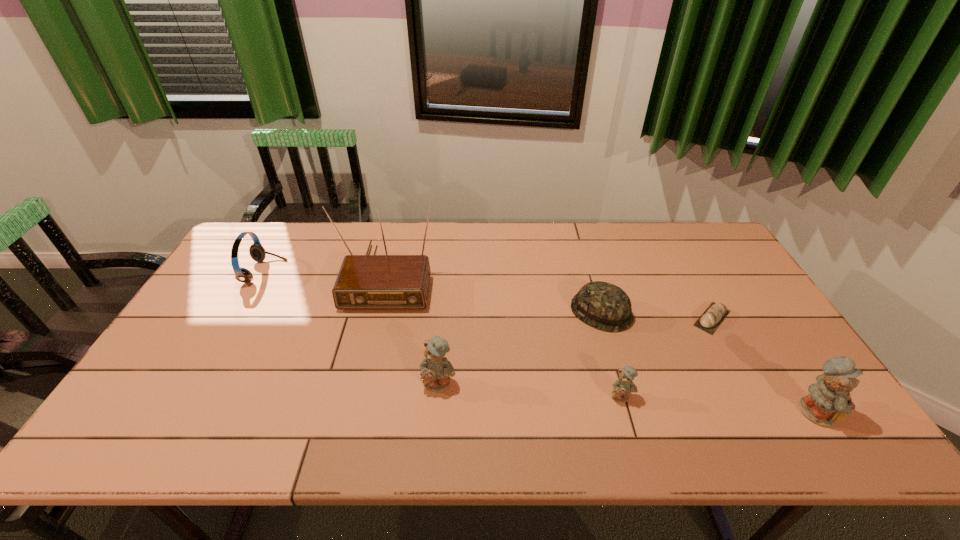
Image resolution: width=960 pixels, height=540 pixels. In order to click on vacant area that lies between the leftmost teddy bear and the tallest object in this screenshot , I will do `click(414, 329)`.

Identify the location of vacant space that is in between the headwear and the shortest teddy bear. (612, 354).

I want to click on empty location between the second teddy bear from left to right and the headwear, so click(612, 354).

Choose which object is the sixth nearest neighbor to the headwear. Please provide its 2D coordinates. Your answer should be formatted as a tuple, i.e. [(x, y)], where the tuple contains the x and y coordinates of a point satisfying the conditions above.

[(257, 252)]

This screenshot has width=960, height=540. I want to click on the sixth closest object to the rightmost object, so click(x=257, y=252).

Choose which teddy bear is the second nearest neighbor to the headwear. Please provide its 2D coordinates. Your answer should be formatted as a tuple, i.e. [(x, y)], where the tuple contains the x and y coordinates of a point satisfying the conditions above.

[(436, 370)]

Locate which teddy bear ranks second in proximity to the second tallest teddy bear. Please provide its 2D coordinates. Your answer should be formatted as a tuple, i.e. [(x, y)], where the tuple contains the x and y coordinates of a point satisfying the conditions above.

[(829, 401)]

Where is `free space that satisfies the following two spatial constraints: 1. on the back side of the pita bread; 2. with the microphone attached to the side of the leftmost object`? free space that satisfies the following two spatial constraints: 1. on the back side of the pita bread; 2. with the microphone attached to the side of the leftmost object is located at coordinates (687, 272).

Locate an element on the screen. vacant space that satisfies the following two spatial constraints: 1. on the front panel of the tallest object; 2. on the right side of the headwear is located at coordinates (379, 312).